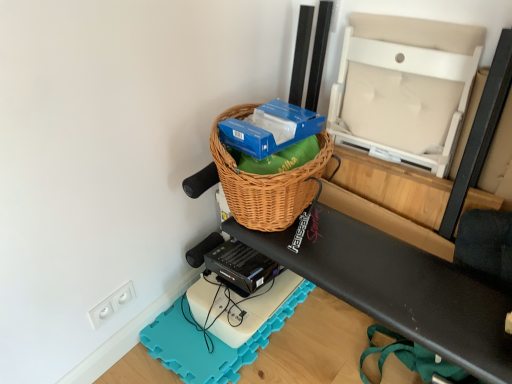
Question: From the image's perspective, is blue cardboard box at upper center positioned above or below beige fabric chair at upper right, which appears as the 2th wide when ordered from the bottom?

Choices:
 (A) above
 (B) below

Answer: (B)

Question: Is blue cardboard box at upper center wider or thinner than beige fabric chair at upper right, which appears as the 2th wide when ordered from the bottom?

Choices:
 (A) wide
 (B) thin

Answer: (A)

Question: Considering the real-world distances, which object is farthest from the white foam yoga mat at lower center?

Choices:
 (A) woven brown picnic basket at upper center
 (B) woven brown basket at center, arranged as the 2th wide when viewed from the top
 (C) blue cardboard box at upper center
 (D) beige fabric chair at upper right, the 1th wide when ordered from top to bottom
 (E) white plastic electric outlet at lower left

Answer: (D)

Question: Which is nearer to the white foam yoga mat at lower center?

Choices:
 (A) white plastic electric outlet at lower left
 (B) woven brown picnic basket at upper center
 (C) beige fabric chair at upper right, the 1th wide when ordered from top to bottom
 (D) blue cardboard box at upper center
 (E) woven brown basket at center, which is counted as the 1th wide, starting from the bottom

Answer: (A)